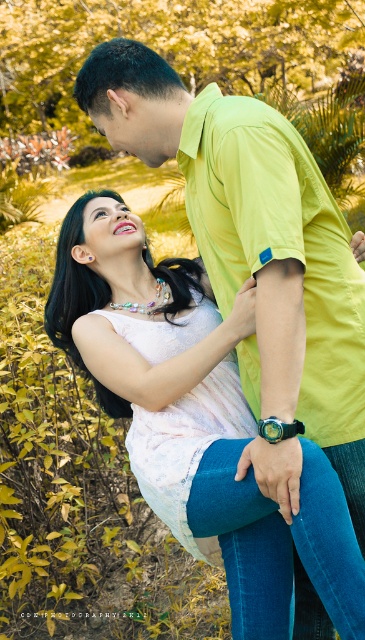
Question: Is matte white blouse at center above matte black forehead at upper center?

Choices:
 (A) yes
 (B) no

Answer: (B)

Question: Is matte white blouse at center further to the viewer compared to matte black forehead at upper center?

Choices:
 (A) no
 (B) yes

Answer: (A)

Question: Does matte white blouse at center have a larger size compared to matte black forehead at upper center?

Choices:
 (A) yes
 (B) no

Answer: (A)

Question: Which point is farther to the camera?

Choices:
 (A) pos(106,211)
 (B) pos(152,381)

Answer: (A)

Question: Which of the following is the closest to the observer?

Choices:
 (A) (116, 205)
 (B) (116, 257)

Answer: (B)